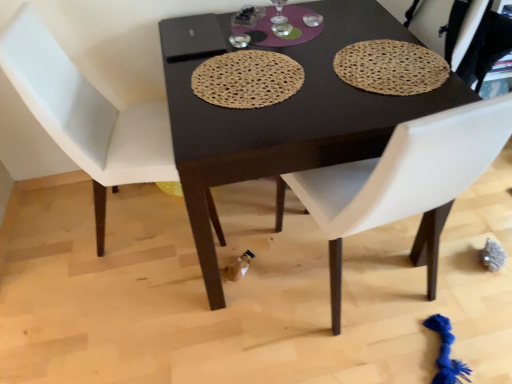
Locate an element on the screen. free space that is in between white leather chair at center, the 1th chair in the right-to-left sequence, and dark brown wood table at center is located at coordinates (290, 318).